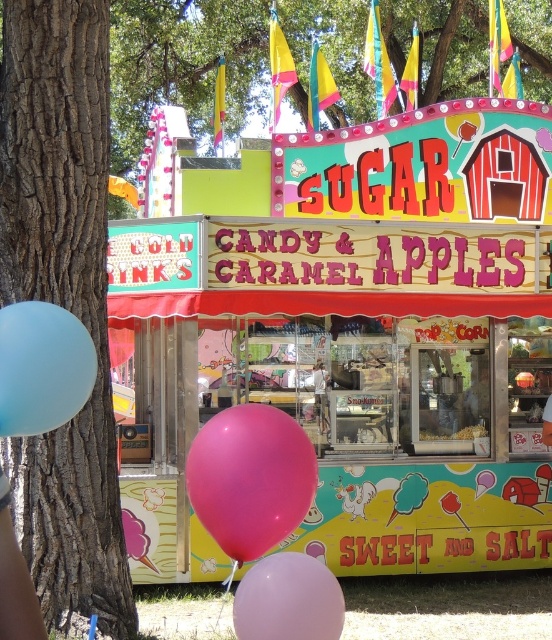
Which is more to the left, matte pink balloon at lower center or light blue rubber balloon at lower left?

light blue rubber balloon at lower left is more to the left.

The image size is (552, 640). Describe the element at coordinates (358, 336) in the screenshot. I see `matte pink balloon at lower center` at that location.

What are the coordinates of `matte pink balloon at lower center` in the screenshot? It's located at (358, 336).

Can you confirm if pink rubber balloon at lower center is shorter than light blue rubber balloon at lower left?

Incorrect, pink rubber balloon at lower center's height does not fall short of light blue rubber balloon at lower left's.

Where is `pink rubber balloon at lower center`? This screenshot has width=552, height=640. pink rubber balloon at lower center is located at coordinates (251, 477).

Which is behind, point (290, 499) or point (82, 371)?

Point (290, 499)

Identify the location of pink rubber balloon at lower center. This screenshot has height=640, width=552. (251, 477).

How distant is pink rubber balloon at lower center from pastel purple balloon at lower center?

A distance of 15.82 inches exists between pink rubber balloon at lower center and pastel purple balloon at lower center.

Is point (203, 461) positioned in front of point (240, 593)?

That is False.

Locate an element on the screen. This screenshot has width=552, height=640. pink rubber balloon at lower center is located at coordinates (251, 477).